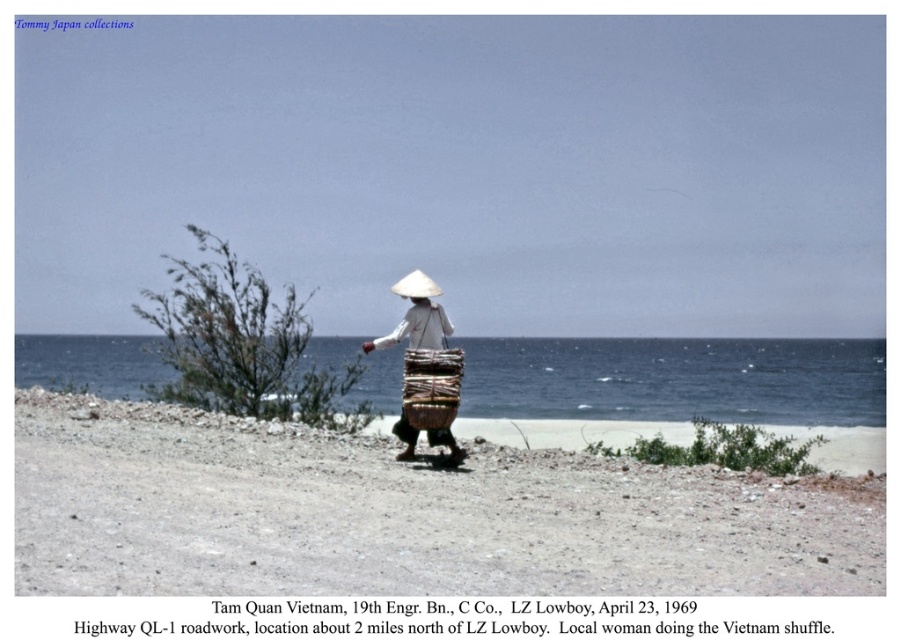
You are standing at the edge of a beach and see both the white woven basket at center and the brown woven basket at center. Which basket is closer to you?

The white woven basket at center is closer to you because the brown woven basket at center is behind it.